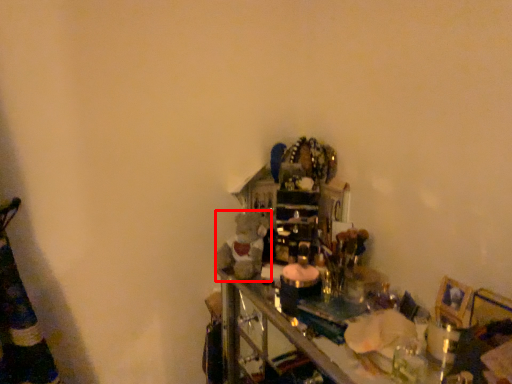
Question: From the image's perspective, considering the relative positions of toy (annotated by the red box) and picture frame in the image provided, where is toy (annotated by the red box) located with respect to the staircase?

Choices:
 (A) above
 (B) below

Answer: (A)